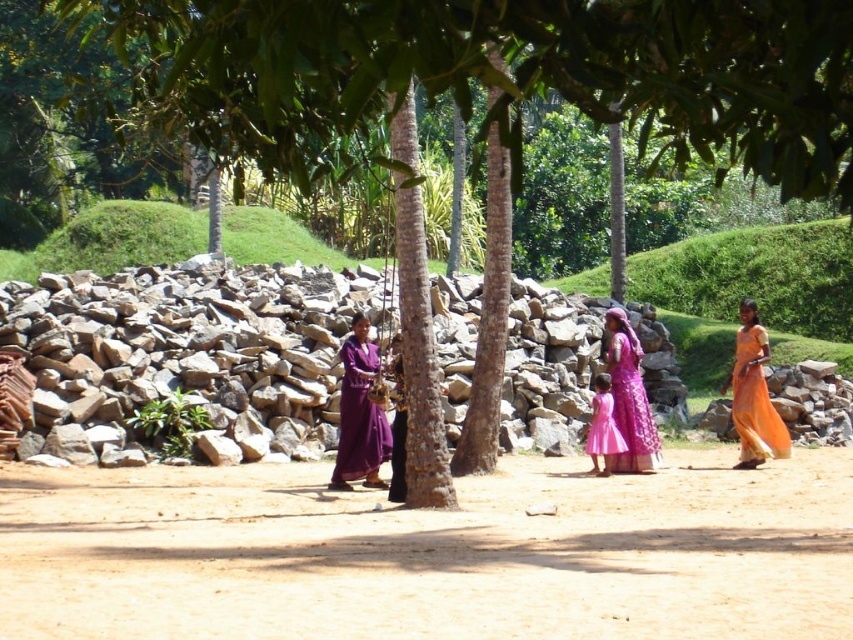
You are an artist planning to paint this scene. You need to decide the order of layers for the purple silk robe at center and the pink satin dress at center so that the one in front is painted last. Which one should you paint last?

The purple silk robe at center is positioned over the pink satin dress at center, so you should paint the purple silk robe at center last to ensure it appears in front.

You are a hiker who wants to place a small tent on the ground in this scene. The tent requires flat terrain. Based on the brown sandy soil at center and gray rough rocks at center, which location would be more suitable for setting up the tent?

The brown sandy soil at center is below the gray rough rocks at center, so the soil area is more level and suitable for setting up the tent compared to the rocky terrain.